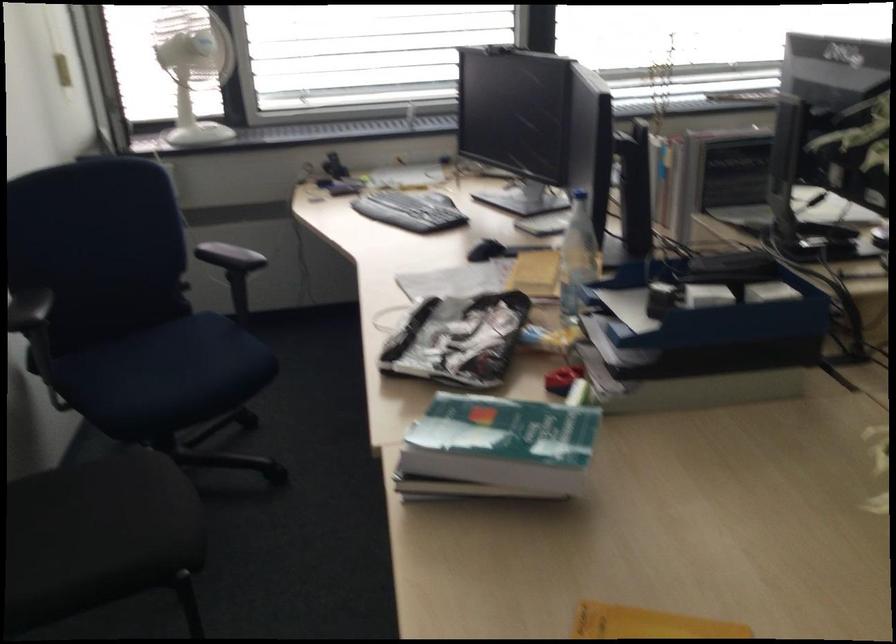
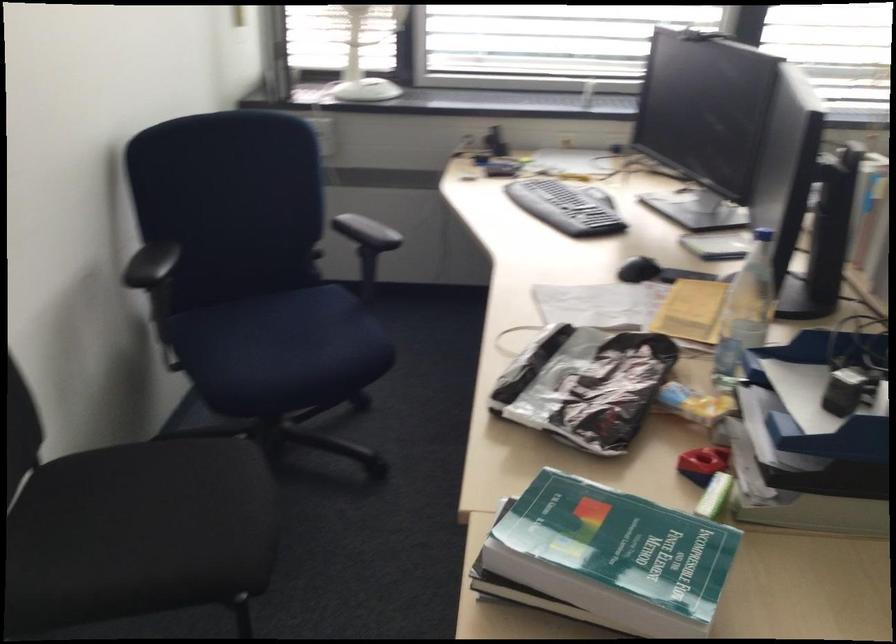
Find the pixel in the second image that matches point (574, 259) in the first image.

(745, 310)